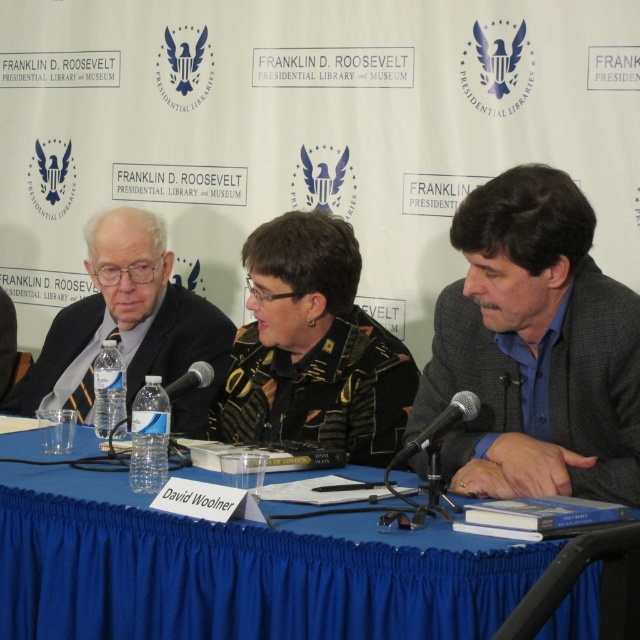
You are standing at the Franklin D. Roosevelt Presidential Library and Museum, looking at the panel discussion setup. There is a point marked at coordinates (202, 348). If you want to place a 3.5 feet wide banner between you and that point, will there be enough space?

The distance between you and the point (202, 348) is 8.60 feet. Since the banner is 3.5 feet wide, there is sufficient space as 3.5 feet is less than 8.60 feet.

You are standing at the center of the image. Which direction should you move to get closer to the matte black suit at left?

You should move to the left to get closer to the matte black suit at left since it is located at the left side of the image.

You are attending the panel discussion at the Franklin D. Roosevelt Presidential Library and Museum and notice two points on the table. The first point is at coordinates point [513,330] and the second is at point [381,330]. Which point is closer to you?

Point [513,330] is closer to the viewer than point [381,330].